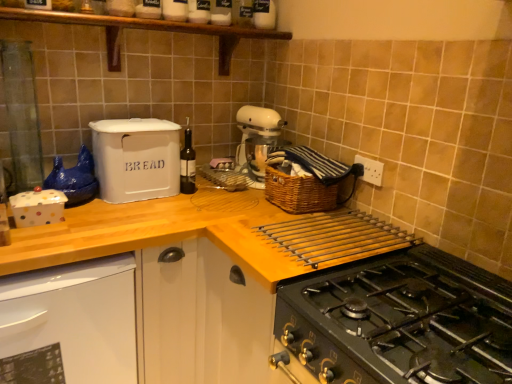
Where is `empty space that is in between dark glass bottle at center and woven brown basket at upper right`? empty space that is in between dark glass bottle at center and woven brown basket at upper right is located at coordinates (230, 201).